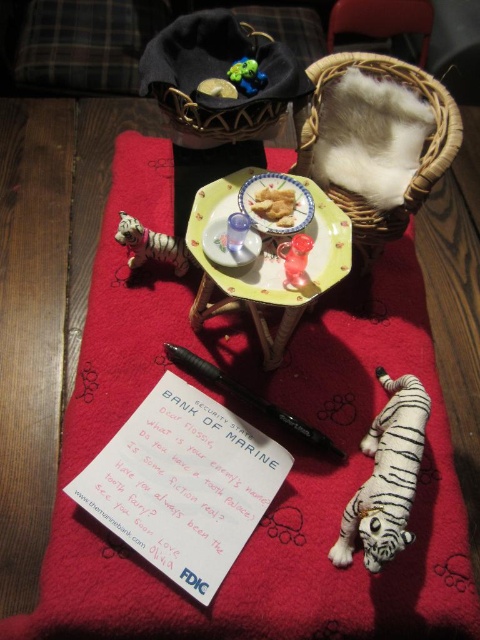
What is located at the coordinates point (249, 397) in the image?

At point (249, 397) lies black plastic pen at lower center.

You are a tiny explorer in this miniature world. You need to place a sticker exactly at the center of the red fabric surface. The black plastic pen at lower center is located at coordinates 0.623 on the x and 0.519 on the y. Can you determine if the pen is positioned closer to the center of the red fabric surface compared to the edge?

The black plastic pen at lower center is located at coordinates 0.623 on the x and 0.519 on the y. Since the center of the red fabric surface would be at coordinates (240, 320), the pen is slightly offset to the right and above the center, but still closer to the center than the edge.